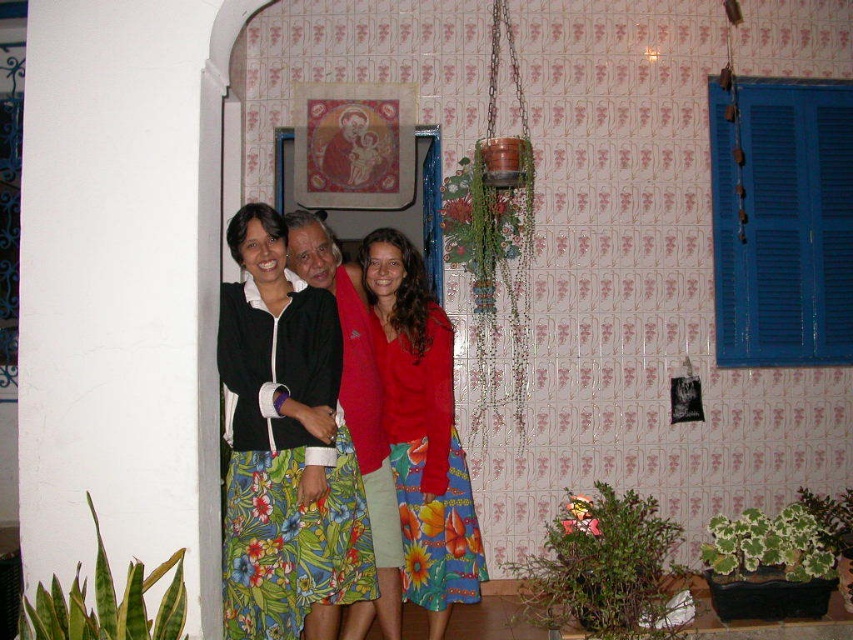
Is blue wooden shutters at right smaller than matte black jacket at center?

Yes, blue wooden shutters at right is smaller than matte black jacket at center.

Can you confirm if blue wooden shutters at right is positioned to the right of matte black jacket at center?

Indeed, blue wooden shutters at right is positioned on the right side of matte black jacket at center.

Who is more distant from viewer, (712, 81) or (355, 618)?

The point (712, 81) is more distant.

Image resolution: width=853 pixels, height=640 pixels. What are the coordinates of `blue wooden shutters at right` in the screenshot? It's located at (782, 221).

Does floral print fabric dress at center appear under matte black jacket at center?

Correct, floral print fabric dress at center is located below matte black jacket at center.

Does floral print fabric dress at center have a smaller size compared to matte black jacket at center?

Yes.

Is point (352, 509) positioned after point (340, 273)?

No, it is in front of (340, 273).

The height and width of the screenshot is (640, 853). Identify the location of floral print fabric dress at center. (285, 467).

Who is positioned more to the right, floral print fabric dress at center or floral skirt at center?

floral skirt at center is more to the right.

Is floral print fabric dress at center wider than floral skirt at center?

Indeed, floral print fabric dress at center has a greater width compared to floral skirt at center.

Find the location of `floral print fabric dress at center`. floral print fabric dress at center is located at coordinates (285, 467).